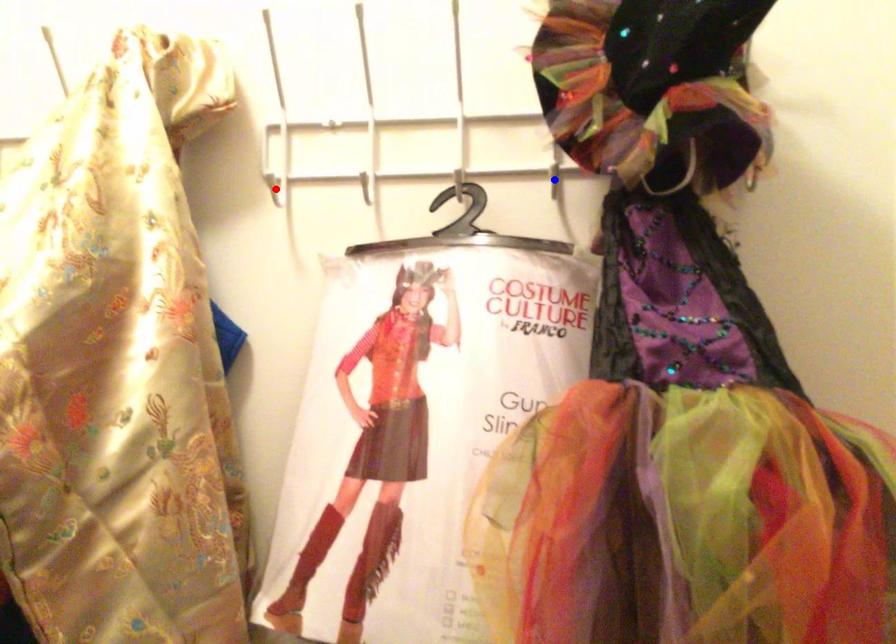
Question: In the image, two points are highlighted. Which point is nearer to the camera? Reply with the corresponding letter.

Choices:
 (A) blue point
 (B) red point

Answer: (A)